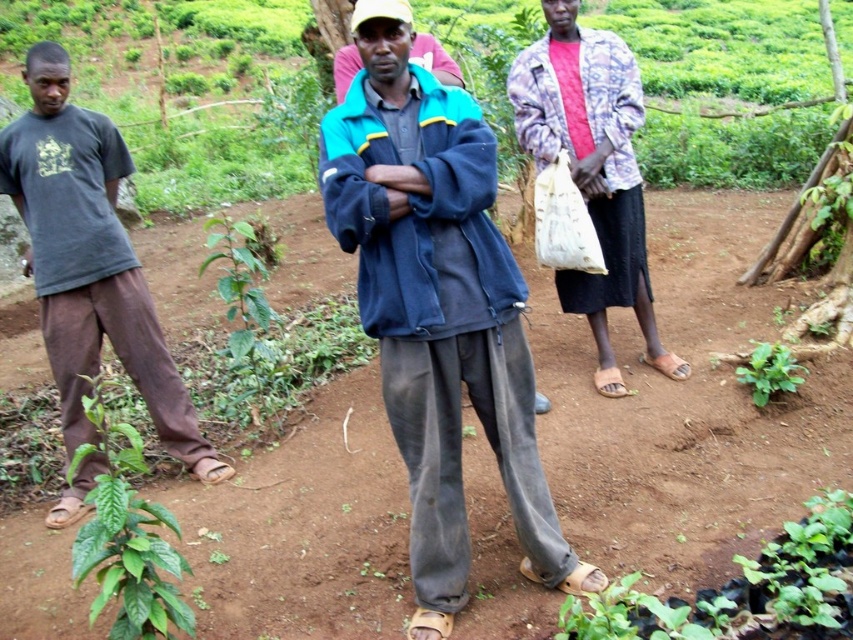
Question: Which point is closer to the camera?

Choices:
 (A) dark blue fleece jacket at center
 (B) brown soil at center

Answer: (A)

Question: Which of the following is the farthest from the observer?

Choices:
 (A) dark gray t-shirt at left
 (B) brown soil at center
 (C) dark blue fleece jacket at center

Answer: (B)

Question: Does brown soil at center appear on the right side of dark gray t-shirt at left?

Choices:
 (A) no
 (B) yes

Answer: (B)

Question: Can you confirm if brown soil at center is positioned to the left of patterned fabric jacket at right?

Choices:
 (A) no
 (B) yes

Answer: (B)

Question: Can you confirm if dark blue fleece jacket at center is bigger than dark gray t-shirt at left?

Choices:
 (A) yes
 (B) no

Answer: (B)

Question: Which object is closer to the camera taking this photo?

Choices:
 (A) patterned fabric jacket at right
 (B) brown soil at center
 (C) dark gray t-shirt at left

Answer: (C)